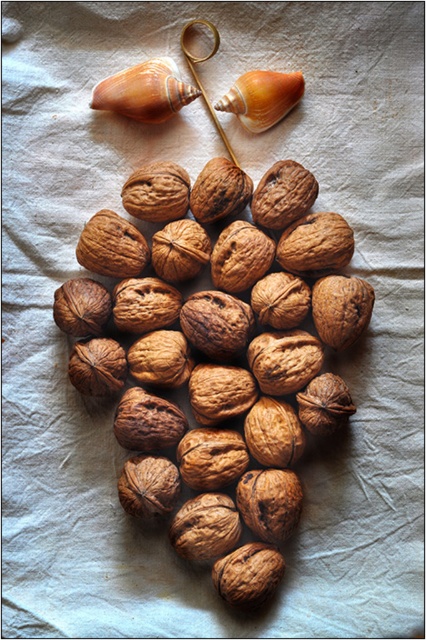
You are an artist trying to sketch the scene. You need to place the matte brown shell at upper left accurately. According to the coordinates provided, where should you position it on your paper?

The matte brown shell at upper left should be positioned at coordinates point (144, 92).

You are organizing a craft project and have two matte brown shells on your table. You need to place the larger one into a box. Which one should you choose between the matte brown shell at upper left and the matte brown seashell at upper center?

The matte brown shell at upper left is larger in size than the matte brown seashell at upper center, so you should choose the matte brown shell at upper left.